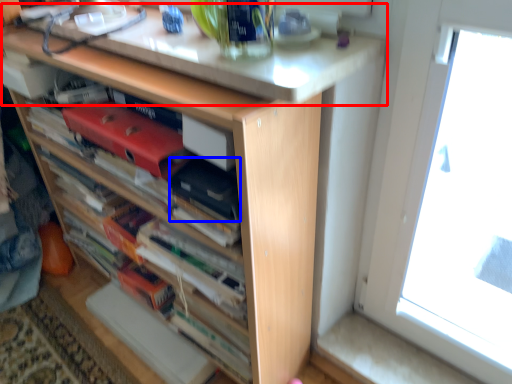
Question: Which of the following is the closest to the observer, counter top (highlighted by a red box) or paperback book (highlighted by a blue box)?

Choices:
 (A) counter top
 (B) paperback book

Answer: (A)